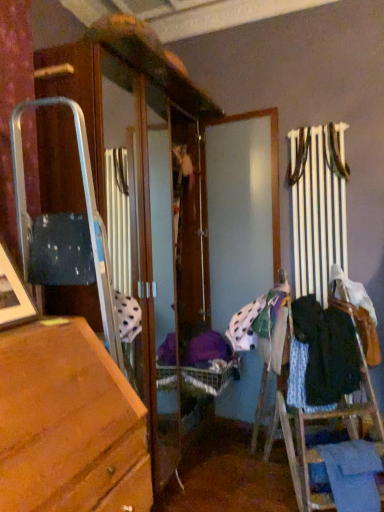
Question: Does dark blue fabric at right, which is counted as the 1th clothing, starting from the top, have a greater width compared to blue fabric at lower right, positioned as the first clothing in bottom-to-top order?

Choices:
 (A) yes
 (B) no

Answer: (A)

Question: Is dark blue fabric at right, the second clothing when ordered from bottom to top, next to blue fabric at lower right, which is the second clothing from top to bottom?

Choices:
 (A) no
 (B) yes

Answer: (A)

Question: Are dark blue fabric at right, which is counted as the 1th clothing, starting from the top, and blue fabric at lower right, which is the second clothing from top to bottom, located far from each other?

Choices:
 (A) yes
 (B) no

Answer: (B)

Question: Is dark blue fabric at right, the second clothing when ordered from bottom to top, shorter than blue fabric at lower right, which is the second clothing from top to bottom?

Choices:
 (A) yes
 (B) no

Answer: (B)

Question: Considering the relative positions of dark blue fabric at right, which is counted as the 1th clothing, starting from the top, and blue fabric at lower right, which is the second clothing from top to bottom, in the image provided, is dark blue fabric at right, which is counted as the 1th clothing, starting from the top, to the right of blue fabric at lower right, which is the second clothing from top to bottom, from the viewer's perspective?

Choices:
 (A) yes
 (B) no

Answer: (B)

Question: From the image's perspective, is dark blue fabric at right, the second clothing when ordered from bottom to top, on top of blue fabric at lower right, which is the second clothing from top to bottom?

Choices:
 (A) no
 (B) yes

Answer: (B)

Question: Is the depth of blue fabric at lower right, which is the second clothing from top to bottom, less than that of dark blue fabric at right, the second clothing when ordered from bottom to top?

Choices:
 (A) yes
 (B) no

Answer: (A)

Question: Is blue fabric at lower right, positioned as the first clothing in bottom-to-top order, next to dark blue fabric at right, the second clothing when ordered from bottom to top?

Choices:
 (A) yes
 (B) no

Answer: (B)

Question: Is blue fabric at lower right, which is the second clothing from top to bottom, turned away from dark blue fabric at right, which is counted as the 1th clothing, starting from the top?

Choices:
 (A) yes
 (B) no

Answer: (B)

Question: Is blue fabric at lower right, positioned as the first clothing in bottom-to-top order, bigger than dark blue fabric at right, the second clothing when ordered from bottom to top?

Choices:
 (A) yes
 (B) no

Answer: (B)

Question: Is blue fabric at lower right, positioned as the first clothing in bottom-to-top order, wider than dark blue fabric at right, the second clothing when ordered from bottom to top?

Choices:
 (A) no
 (B) yes

Answer: (A)

Question: Is blue fabric at lower right, which is the second clothing from top to bottom, outside dark blue fabric at right, which is counted as the 1th clothing, starting from the top?

Choices:
 (A) yes
 (B) no

Answer: (A)

Question: Is dark blue fabric at right, which is counted as the 1th clothing, starting from the top, bigger or smaller than blue fabric at lower right, positioned as the first clothing in bottom-to-top order?

Choices:
 (A) big
 (B) small

Answer: (A)